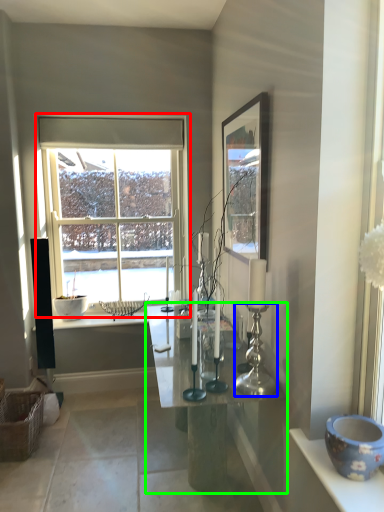
Question: Which object is positioned closest to window (highlighted by a red box)? Select from candle holder (highlighted by a blue box) and table (highlighted by a green box).

Choices:
 (A) candle holder
 (B) table

Answer: (B)